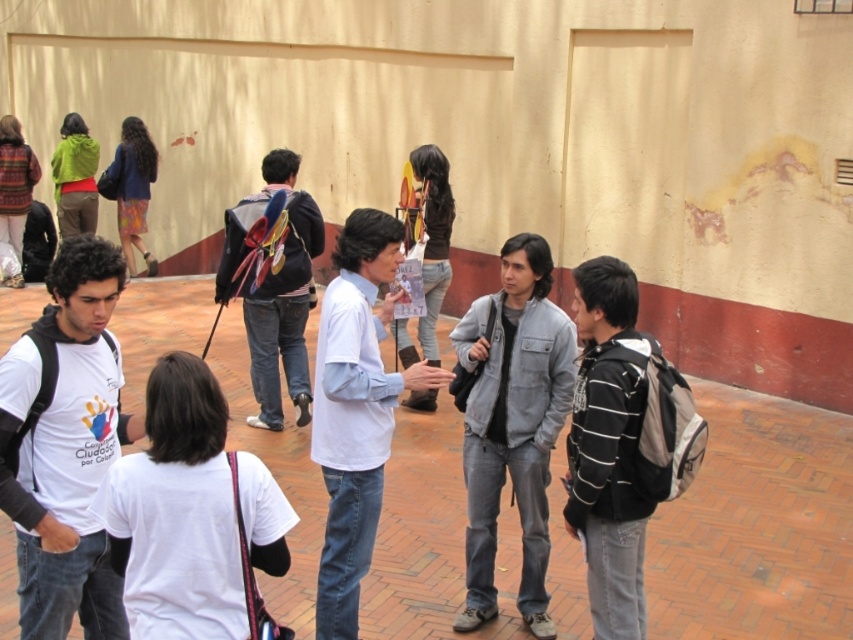
Between white matte t-shirt at center and white cotton shirt at center, which one is positioned lower?

white matte t-shirt at center is lower down.

Identify the location of white matte t-shirt at center. (177, 512).

I want to click on white matte t-shirt at center, so click(x=177, y=512).

Does gray denim jacket at center have a greater width compared to white cotton shirt at center?

Incorrect, gray denim jacket at center's width does not surpass white cotton shirt at center's.

Who is more forward, (519, 609) or (381, 438)?

Point (381, 438) is more forward.

Between point (525, 525) and point (325, 449), which one is positioned behind?

The point (525, 525) is behind.

The height and width of the screenshot is (640, 853). Identify the location of gray denim jacket at center. (512, 422).

Does white matte t-shirt at center come behind gray denim jacket at center?

No, it is not.

Does white matte t-shirt at center appear over gray denim jacket at center?

Indeed, white matte t-shirt at center is positioned over gray denim jacket at center.

Find the location of a particular element. This screenshot has width=853, height=640. white matte t-shirt at center is located at coordinates (177, 512).

Identify the location of white matte t-shirt at center. The height and width of the screenshot is (640, 853). (177, 512).